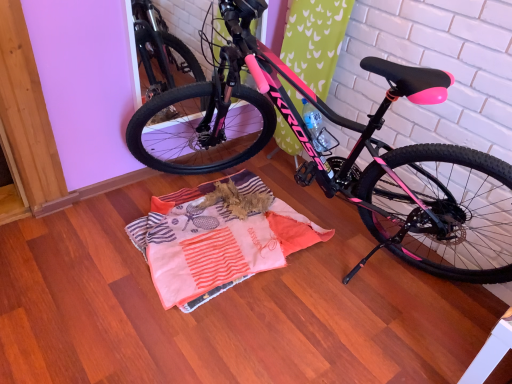
At what (x,y) coordinates should I click in order to perform the action: click on unoccupied area in front of striped cotton blanket at center. Please return your answer as a coordinate pair (x, y). Looking at the image, I should click on (199, 332).